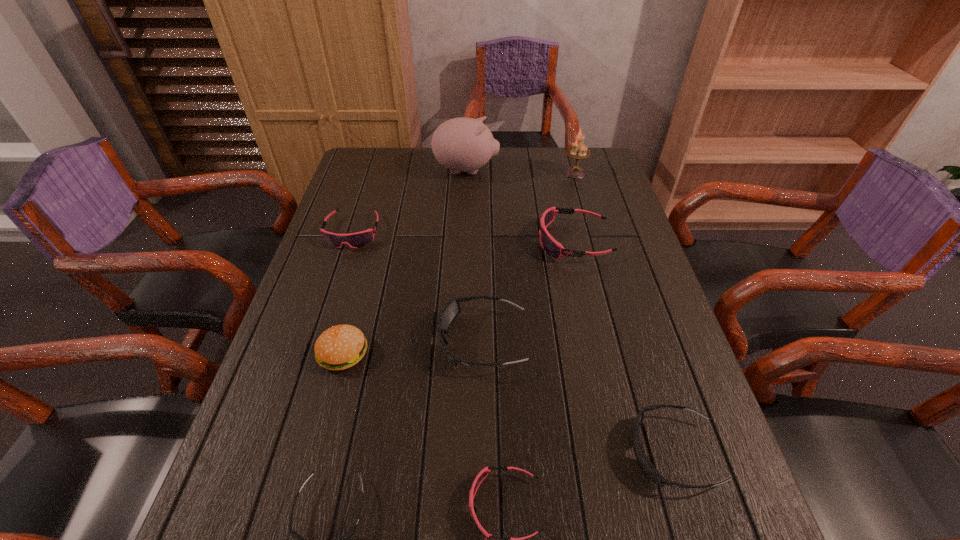
Find the location of a particular element. piggy bank is located at coordinates (462, 144).

You are a GUI agent. You are given a task and a screenshot of the screen. Output one action in this format:
    pyautogui.click(x=<x>, y=<y>)
    Task: Click on the candle holder
    
    Given the screenshot: What is the action you would take?
    pyautogui.click(x=577, y=151)

In order to click on the rightmost pink goggles in this screenshot , I will do `click(550, 245)`.

Locate an element on the screen. the third farthest goggles is located at coordinates (449, 312).

The image size is (960, 540). I want to click on the farthest black goggles, so click(x=449, y=312).

Where is `brown patty`? This screenshot has height=540, width=960. brown patty is located at coordinates (340, 347).

This screenshot has width=960, height=540. I want to click on the leftmost pink goggles, so click(355, 240).

Identify the location of the second smallest black goggles. (644, 462).

This screenshot has height=540, width=960. Identify the location of free space located at the snout of the piggy bank. (601, 170).

In order to click on vacant space located on the front of the candle holder in this screenshot , I will do `click(587, 216)`.